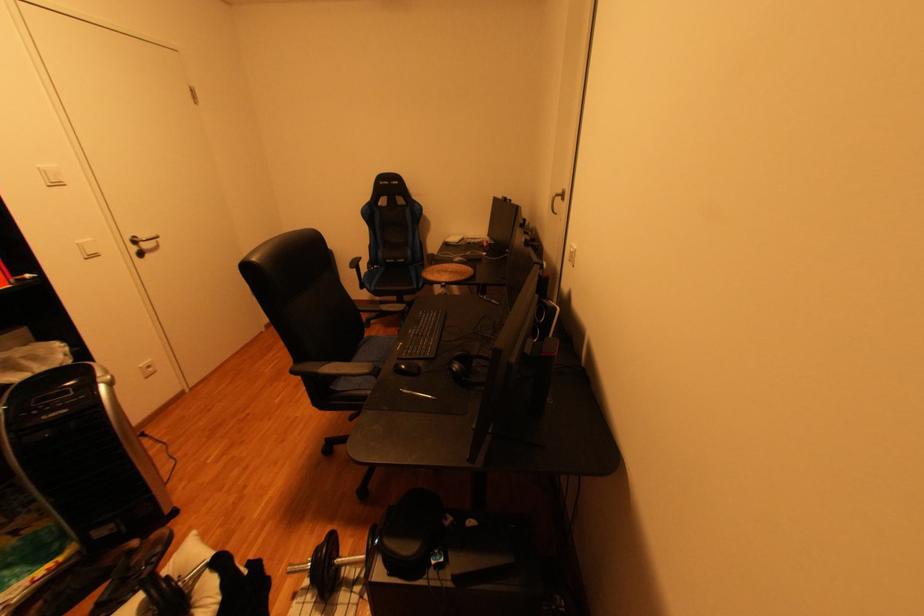
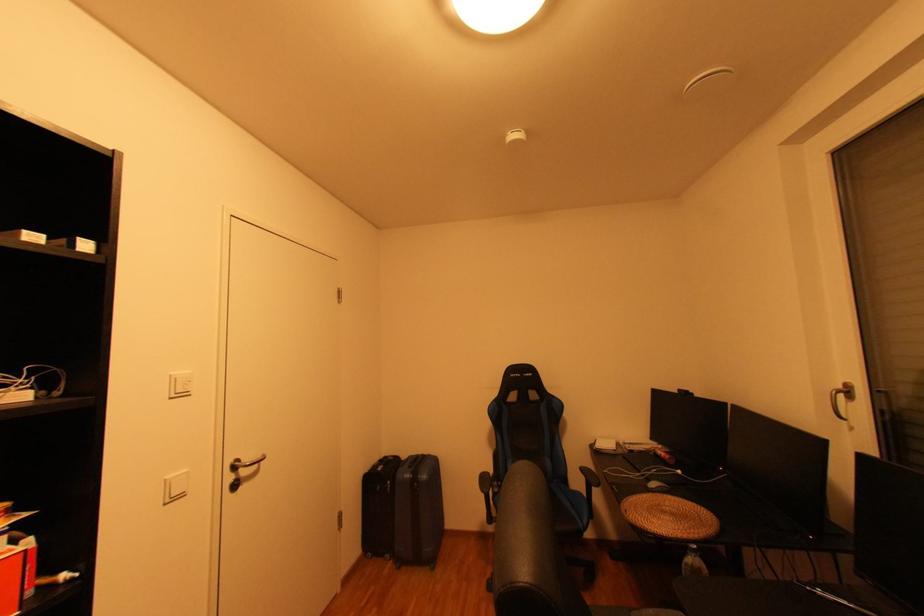
Question: Based on the continuous images, in which direction is the camera rotating? Reply with the corresponding letter.

Choices:
 (A) Left
 (B) Right
 (C) Up
 (D) Down

Answer: (C)